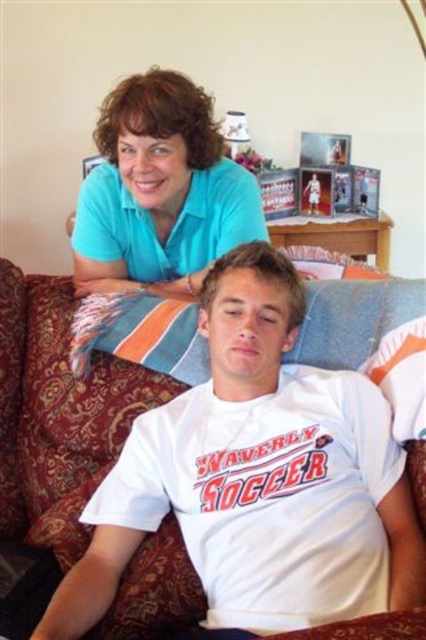
Question: Does velvet-like brown couch at center have a smaller size compared to matte blue shirt at upper left?

Choices:
 (A) yes
 (B) no

Answer: (B)

Question: Does velvet-like brown couch at center have a greater width compared to matte blue shirt at upper left?

Choices:
 (A) yes
 (B) no

Answer: (B)

Question: Which object is closer to the camera taking this photo?

Choices:
 (A) velvet-like brown couch at center
 (B) matte blue shirt at upper left

Answer: (A)

Question: Is velvet-like brown couch at center closer to the viewer compared to matte blue shirt at upper left?

Choices:
 (A) yes
 (B) no

Answer: (A)